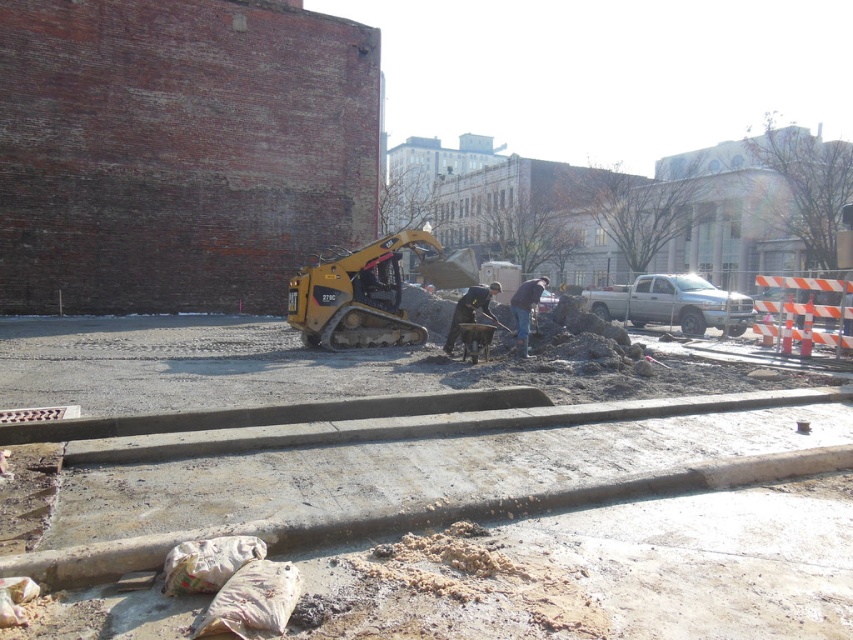
Measure the distance between matte concrete sidewalk at center and camera.

They are 9.70 feet apart.

Who is lower down, matte concrete sidewalk at center or dark gray uniform at center?

matte concrete sidewalk at center

Is point (257, 529) farther from viewer compared to point (453, 323)?

No, it is in front of (453, 323).

Locate an element on the screen. matte concrete sidewalk at center is located at coordinates (466, 524).

Does matte concrete sidewalk at center appear under black rubber excavator at center?

Yes.

Is the position of matte concrete sidewalk at center less distant than that of black rubber excavator at center?

That is True.

Who is more distant from viewer, (51, 556) or (395, 320)?

Point (395, 320)

The width and height of the screenshot is (853, 640). Identify the location of matte concrete sidewalk at center. [x=466, y=524].

Is black rubber excavator at center shorter than dark gray uniform at center?

Correct, black rubber excavator at center is not as tall as dark gray uniform at center.

Who is higher up, black rubber excavator at center or dark gray uniform at center?

black rubber excavator at center is above.

Is point (384, 285) positioned before point (492, 314)?

Yes, it is.

Find the location of a particular element. Image resolution: width=853 pixels, height=640 pixels. black rubber excavator at center is located at coordinates (370, 291).